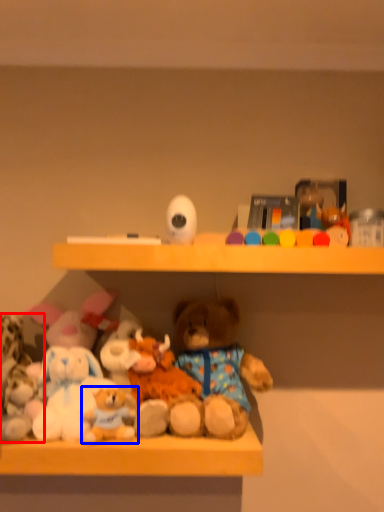
Question: Among these objects, which one is nearest to the camera, toy (highlighted by a red box) or toy (highlighted by a blue box)?

Choices:
 (A) toy
 (B) toy

Answer: (B)